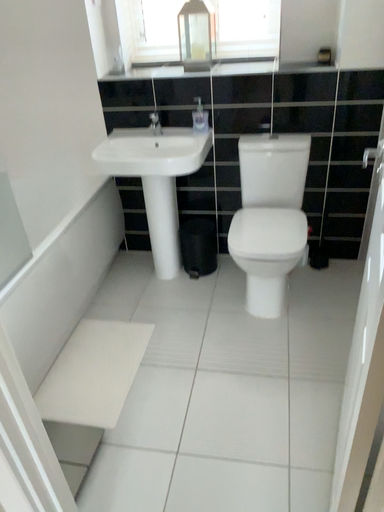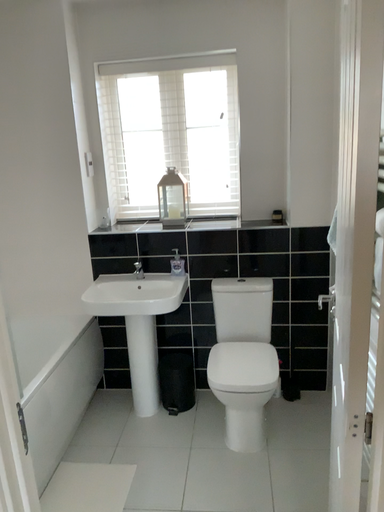
Question: Which way did the camera rotate in the video?

Choices:
 (A) rotated upward
 (B) rotated downward

Answer: (A)